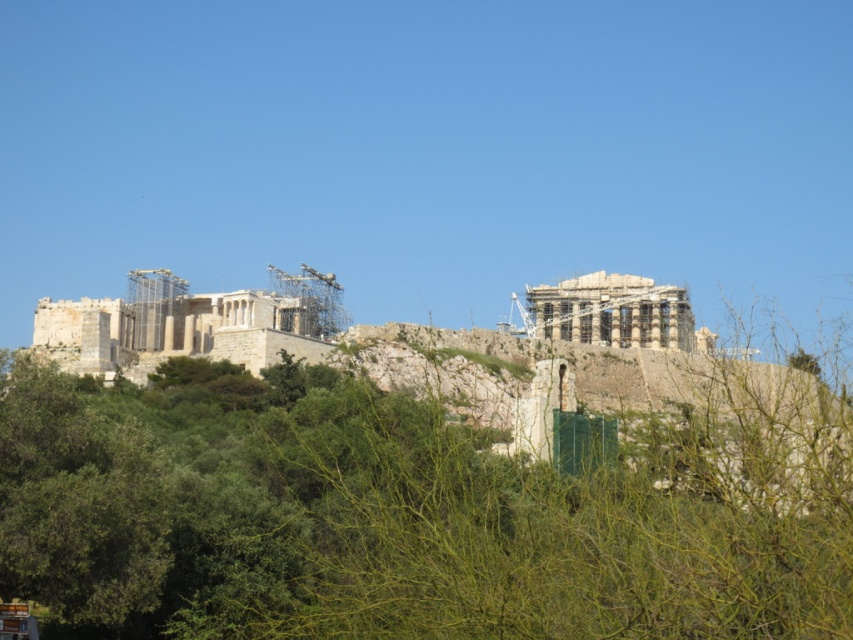
Question: Can you confirm if stone classical temple at left is smaller than white stone temple at upper right?

Choices:
 (A) no
 (B) yes

Answer: (A)

Question: Which point is farther to the camera?

Choices:
 (A) white stone temple at upper right
 (B) stone classical temple at left

Answer: (A)

Question: Which point is closer to the camera?

Choices:
 (A) (677, 348)
 (B) (305, 272)

Answer: (B)

Question: Is stone classical temple at left smaller than white stone temple at upper right?

Choices:
 (A) yes
 (B) no

Answer: (B)

Question: Which of the following is the farthest from the observer?

Choices:
 (A) stone classical temple at left
 (B) white stone temple at upper right

Answer: (B)

Question: Does stone classical temple at left appear on the left side of white stone temple at upper right?

Choices:
 (A) yes
 (B) no

Answer: (A)